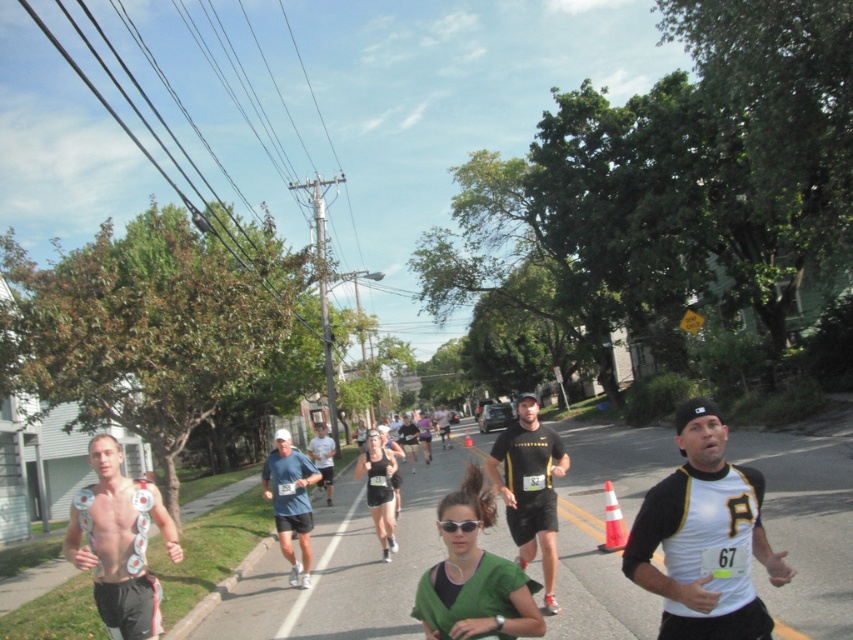
You are a photographer at the marathon event. You want to take a photo of the shiny metallic medals at left and the black matte shirt at center. Which object appears narrower in the photo?

The shiny metallic medals at left appears narrower than the black matte shirt at center in the photo.

You are a runner in the marathon and you notice two objects at the center of your path. One is the black plastic sunglasses at center and the other is the orange traffic cone at center. Which object is blocking your view of the other?

The black plastic sunglasses at center is positioned over the orange traffic cone at center, so the sunglasses are blocking the view of the traffic cone.

Based on the photo, you are a photographer at the marathon event and want to capture a photo that includes both the shiny metallic medals at left and the blue fabric shirt at center. Which object should you zoom in on to ensure both are clearly visible in the frame?

The shiny metallic medals at left has a smaller size compared to blue fabric shirt at center. To ensure both are clearly visible, you should zoom in on the shiny metallic medals at left so that its smaller size can be captured while the larger blue fabric shirt at center remains in focus.